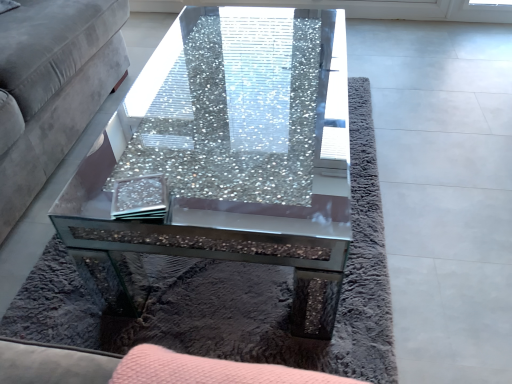
Question: Relative to velvet grey couch at left, is crushed glass coffee table at center in front or behind?

Choices:
 (A) front
 (B) behind

Answer: (B)

Question: Is crushed glass coffee table at center taller or shorter than velvet grey couch at left?

Choices:
 (A) tall
 (B) short

Answer: (B)

Question: Considering the real-world distances, which object is closest to the velvet grey couch at left?

Choices:
 (A) clear glass coaster at center
 (B) crushed glass coffee table at center

Answer: (B)

Question: Based on their relative distances, which object is farther from the velvet grey couch at left?

Choices:
 (A) clear glass coaster at center
 (B) crushed glass coffee table at center

Answer: (A)